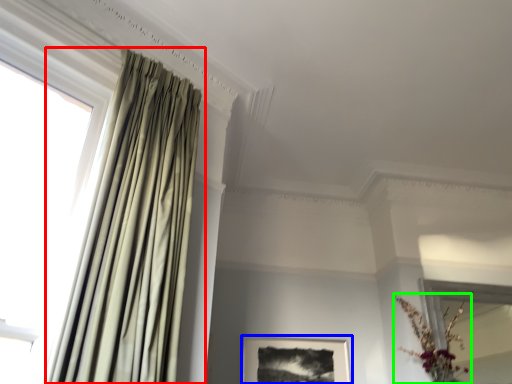
Question: Which object is positioned closest to curtain (highlighted by a red box)? Select from picture frame (highlighted by a blue box) and floral arrangement (highlighted by a green box).

Choices:
 (A) picture frame
 (B) floral arrangement

Answer: (A)